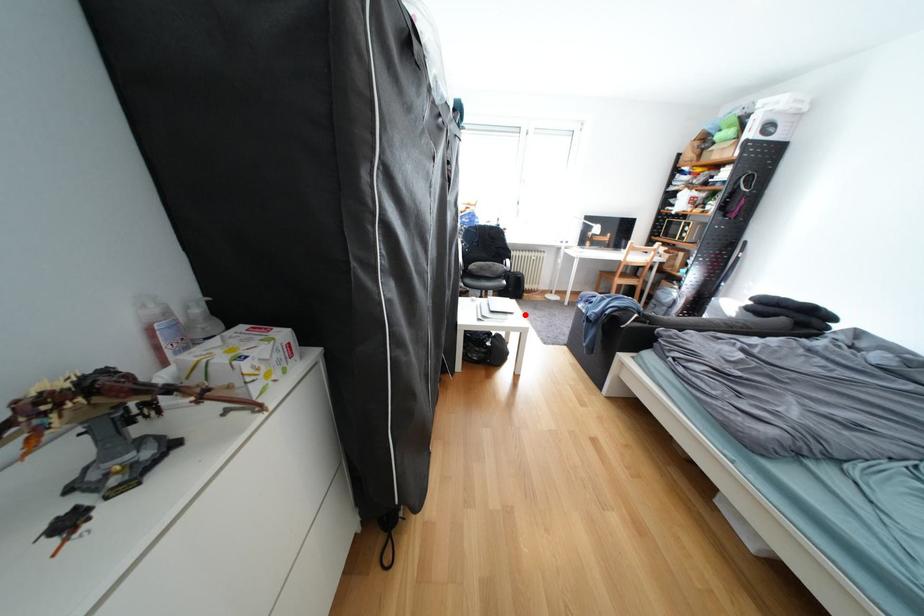
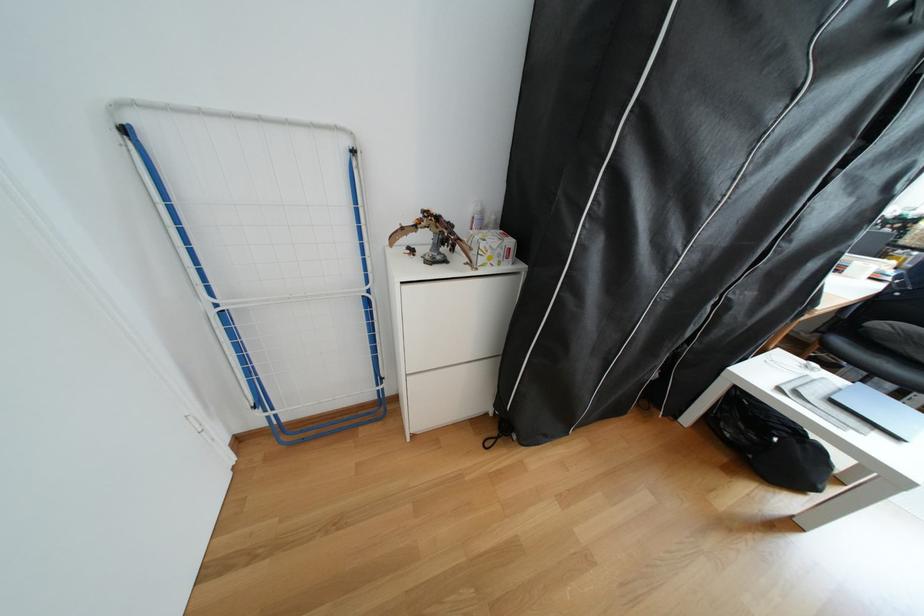
Question: I am providing you with two images of the same scene from different viewpoints. Given a red point in image1, look at the same physical point in image2. Is it:

Choices:
 (A) Closer to the viewpoint
 (B) Farther from the viewpoint

Answer: (A)